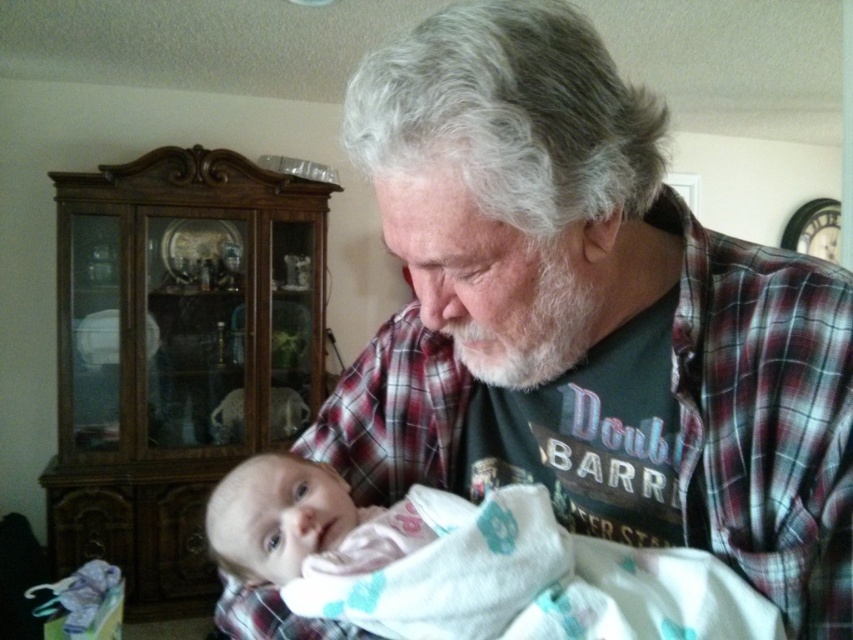
Who is more forward, (502, 442) or (468, 548)?

Point (468, 548)

Who is more distant from viewer, (654, 339) or (390, 513)?

Positioned behind is point (390, 513).

Is point (498, 3) closer to viewer compared to point (604, 616)?

Yes, point (498, 3) is closer to viewer.

In order to click on plaid flannel shirt at center in this screenshot , I will do `click(592, 314)`.